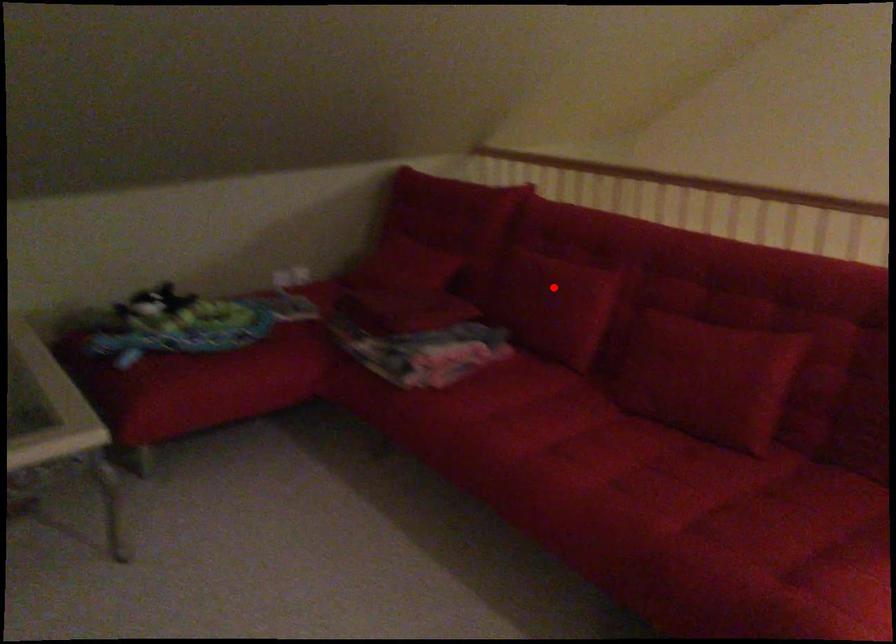
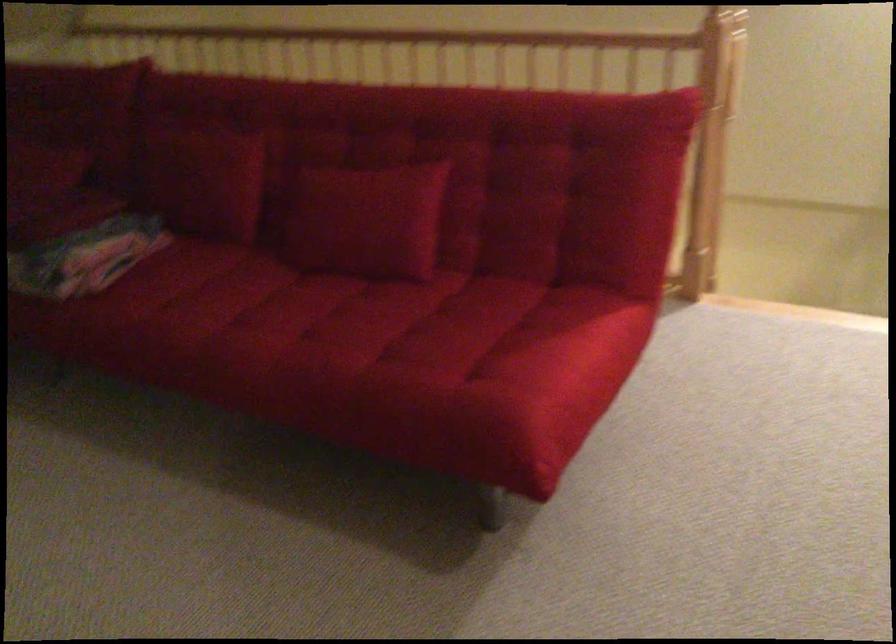
Where in the second image is the point corresponding to the highlighted location from the first image?

(202, 176)